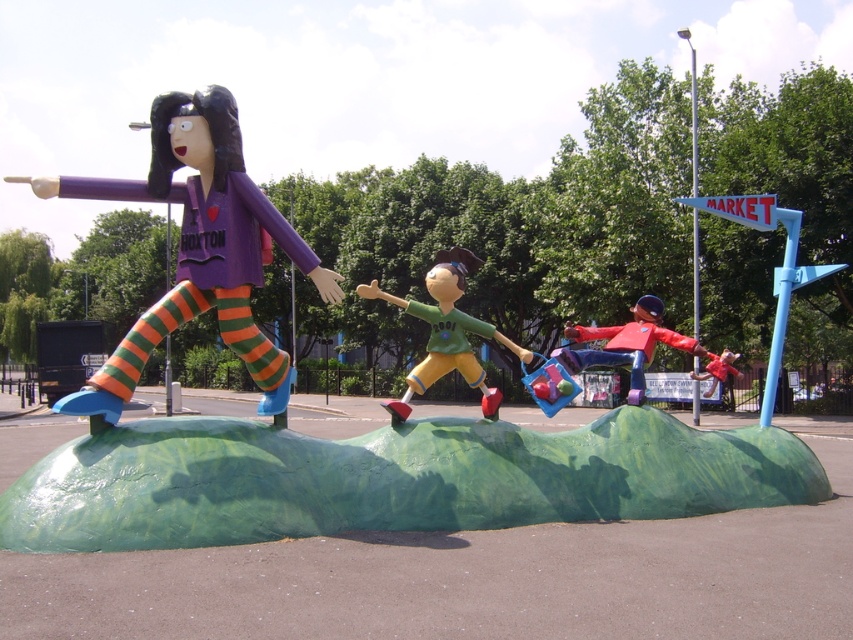
What are the coordinates of the matte purple figure at left in the image?

The coordinates of the matte purple figure at left are at point [212,248].

You are a visitor standing in front of the sculpture. You see the matte purple figure at left and the matte green plastic toy at center. Which object is positioned farther to the right?

The matte green plastic toy at center is positioned farther to the right than the matte purple figure at left.